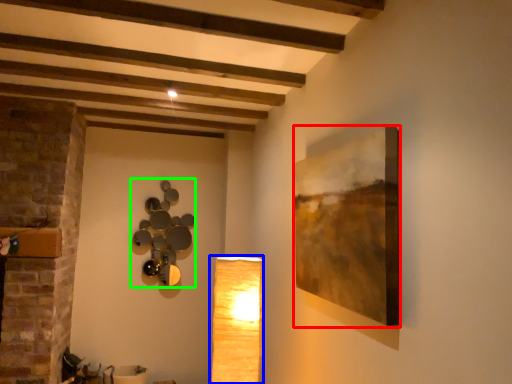
Question: Estimate the real-world distances between objects in this image. Which object is farther from picture frame (highlighted by a red box), lamp (highlighted by a blue box) or lamp (highlighted by a green box)?

Choices:
 (A) lamp
 (B) lamp

Answer: (B)